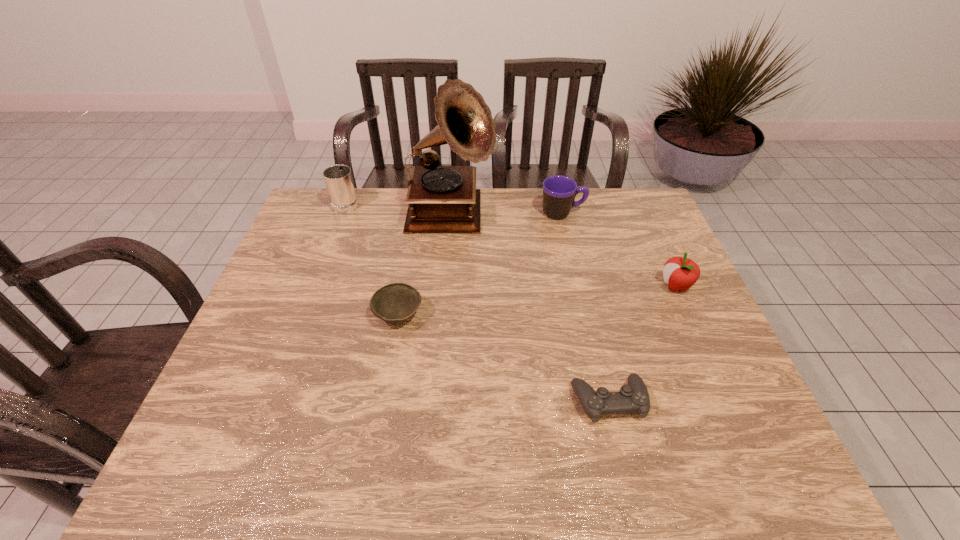
At what (x,y) coordinates should I click in order to perform the action: click on free space located on the back of the control. Please return your answer as a coordinate pair (x, y). Looking at the image, I should click on (581, 282).

This screenshot has width=960, height=540. In order to click on record player located in the far edge section of the desktop in this screenshot , I will do `click(441, 198)`.

This screenshot has height=540, width=960. What are the coordinates of `object at the left edge` in the screenshot? It's located at (339, 182).

At what (x,y) coordinates should I click in order to perform the action: click on object present at the right edge. Please return your answer as a coordinate pair (x, y). Looking at the image, I should click on (680, 273).

Locate an element on the screen. This screenshot has width=960, height=540. object that is at the far left corner is located at coordinates (339, 182).

Identify the location of free region at the far edge of the desktop. This screenshot has height=540, width=960. (543, 220).

Locate an element on the screen. The height and width of the screenshot is (540, 960). vacant region at the left edge of the desktop is located at coordinates (272, 335).

In the image, there is a desktop. Identify the location of free space at the right edge. The height and width of the screenshot is (540, 960). (710, 373).

Find the location of a particular element. The image size is (960, 540). free point at the far left corner is located at coordinates (340, 213).

In the image, there is a desktop. Find the location of `vacant space at the far right corner`. vacant space at the far right corner is located at coordinates (608, 205).